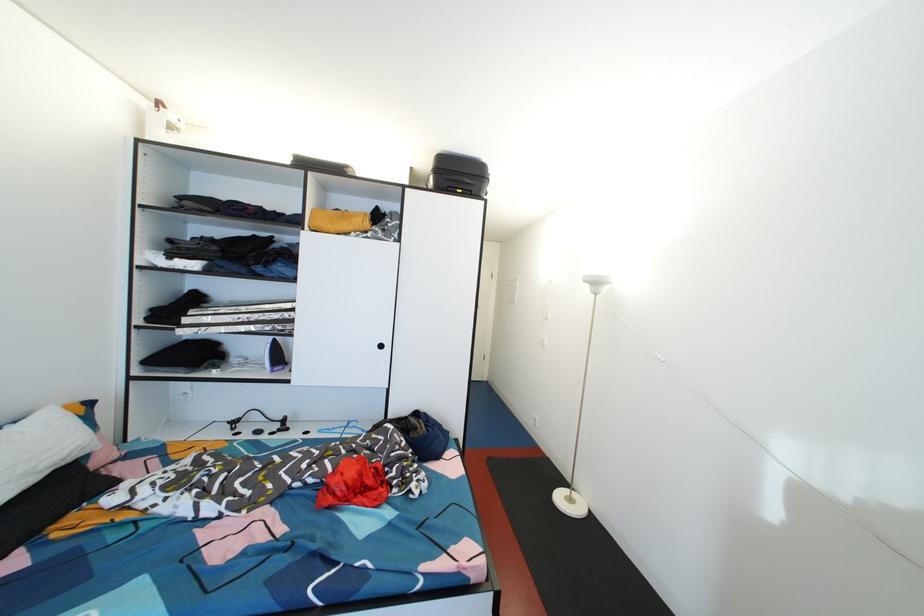
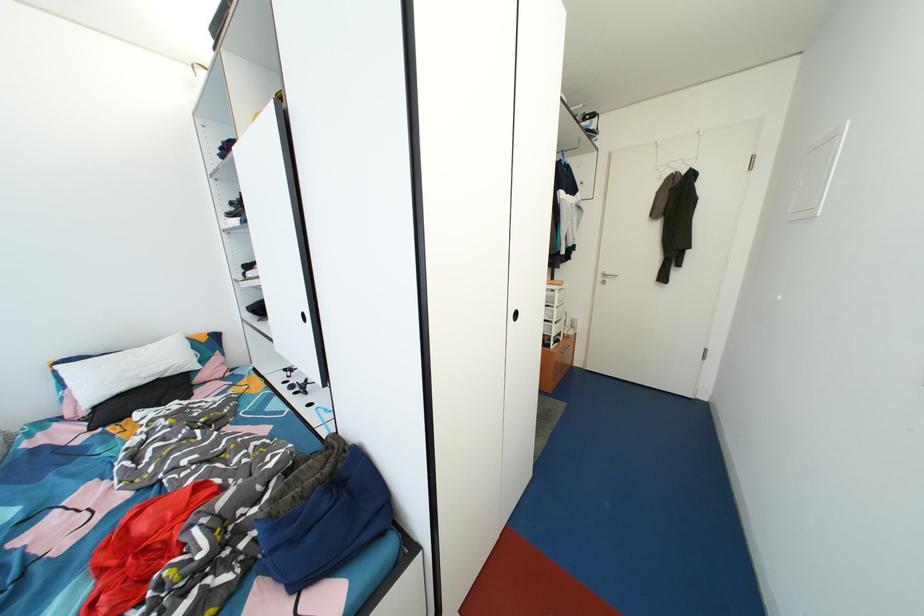
Where in the second image is the point corresponding to (x=73, y=458) from the first image?

(167, 373)